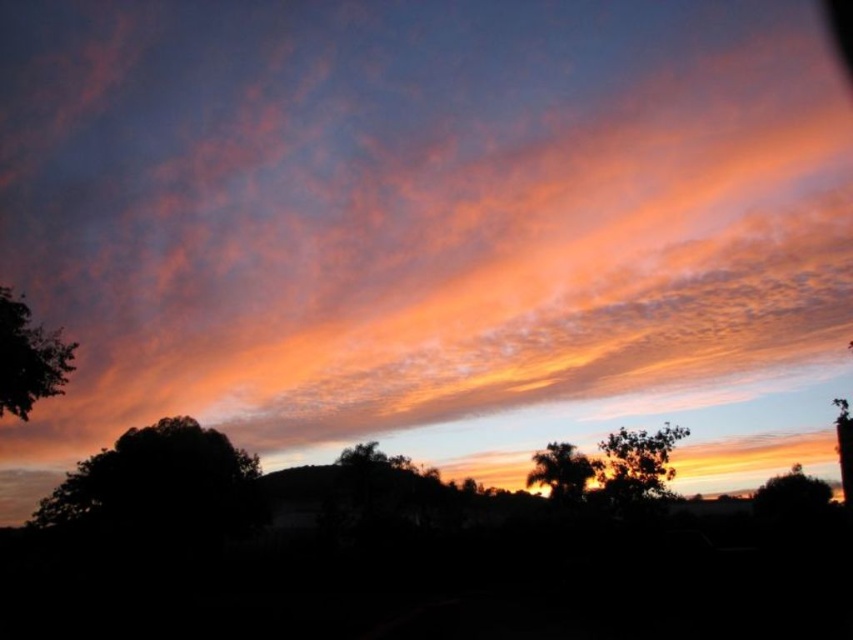
In the scene shown: You are an artist trying to paint the sunset scene. You need to decide which object to paint first based on their positions. Since the cloudy sky at upper center is much taller than the green leafy tree at left, which object should you paint first to ensure proper layering?

You should paint the cloudy sky at upper center first because it is much taller than the green leafy tree at left, allowing you to establish the background before adding foreground elements.

You are an artist trying to paint the sunset scene. You want to ensure the silhouette tree at left and the silhouetted tree at center are proportionally accurate. Which tree should you draw wider in your painting?

The silhouette tree at left should be drawn wider than the silhouetted tree at center according to the description.